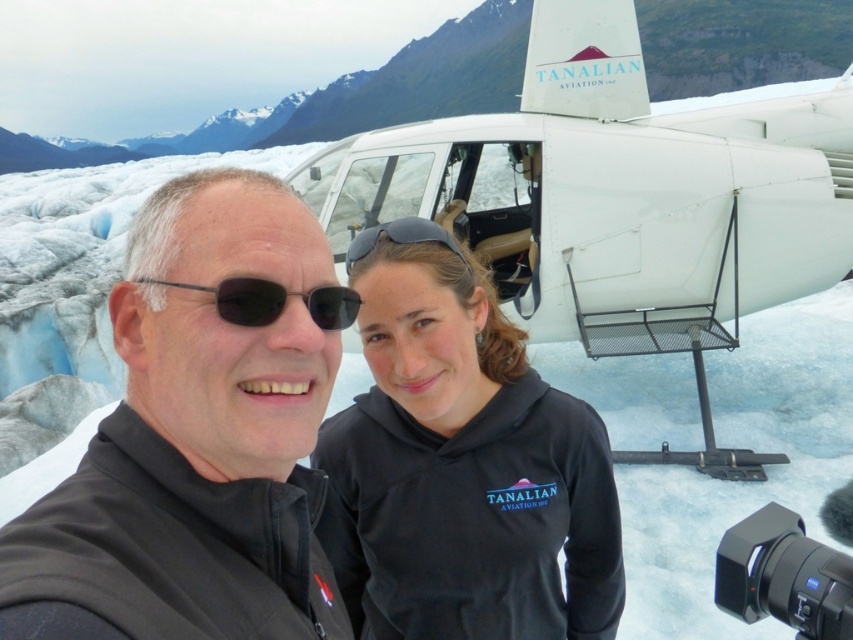
Question: Can you confirm if black plastic sunglasses at left is positioned to the right of black matte sunglasses at center?

Choices:
 (A) no
 (B) yes

Answer: (A)

Question: Among these objects, which one is nearest to the camera?

Choices:
 (A) black matte sunglasses at center
 (B) black plastic sunglasses at left
 (C) black plastic video camera at lower right

Answer: (B)

Question: Estimate the real-world distances between objects in this image. Which object is closer to the black fleece at center?

Choices:
 (A) white matte airplane at upper right
 (B) black plastic video camera at lower right

Answer: (B)

Question: Can you confirm if black plastic video camera at lower right is bigger than black plastic sunglasses at left?

Choices:
 (A) no
 (B) yes

Answer: (B)

Question: Is white matte airplane at upper right smaller than black plastic sunglasses at left?

Choices:
 (A) no
 (B) yes

Answer: (A)

Question: Among these objects, which one is nearest to the camera?

Choices:
 (A) black matte sunglasses at center
 (B) black plastic video camera at lower right
 (C) black softshell jacket at center
 (D) black fleece at center

Answer: (C)